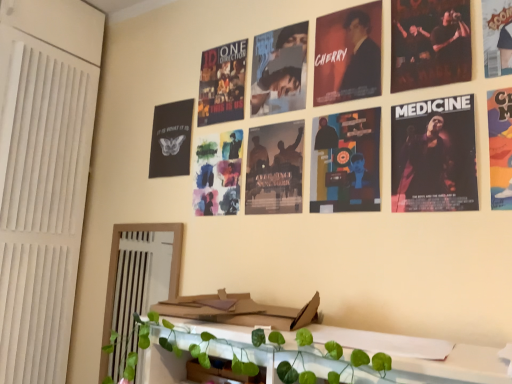
Question: From the image's perspective, is cartoon character poster at upper right, positioned as the sixth poster in left-to-right order, below cardboard magazine at center?

Choices:
 (A) no
 (B) yes

Answer: (A)

Question: Is the depth of cartoon character poster at upper right, which ranks as the first poster in right-to-left order, less than that of cardboard magazine at center?

Choices:
 (A) yes
 (B) no

Answer: (A)

Question: Could you tell me if cartoon character poster at upper right, positioned as the sixth poster in left-to-right order, is facing cardboard magazine at center?

Choices:
 (A) no
 (B) yes

Answer: (A)

Question: Is cartoon character poster at upper right, which ranks as the first poster in right-to-left order, beside cardboard magazine at center?

Choices:
 (A) no
 (B) yes

Answer: (A)

Question: Considering the relative positions of cartoon character poster at upper right, which ranks as the first poster in right-to-left order, and cardboard magazine at center in the image provided, is cartoon character poster at upper right, which ranks as the first poster in right-to-left order, to the right of cardboard magazine at center from the viewer's perspective?

Choices:
 (A) yes
 (B) no

Answer: (A)

Question: In the image, is matte black poster at upper right, arranged as the 3th poster when viewed from the right, positioned in front of or behind cardboard magazine at center?

Choices:
 (A) behind
 (B) front

Answer: (A)

Question: Does point (437, 41) appear closer or farther from the camera than point (237, 317)?

Choices:
 (A) farther
 (B) closer

Answer: (A)

Question: From a real-world perspective, is matte black poster at upper right, arranged as the 3th poster when viewed from the right, physically located above or below cardboard magazine at center?

Choices:
 (A) below
 (B) above

Answer: (B)

Question: In terms of width, does matte black poster at upper right, the fourth poster from the left, look wider or thinner when compared to cardboard magazine at center?

Choices:
 (A) thin
 (B) wide

Answer: (A)

Question: From the image's perspective, relative to colorful paper poster at upper right, arranged as the fifth poster when viewed from the left, is matte black poster at upper right, arranged as the 3th poster when viewed from the right, above or below?

Choices:
 (A) above
 (B) below

Answer: (A)

Question: In the image, is matte black poster at upper right, arranged as the 3th poster when viewed from the right, positioned in front of or behind colorful paper poster at upper right, the 2th poster positioned from the right?

Choices:
 (A) behind
 (B) front

Answer: (A)

Question: In terms of width, does matte black poster at upper right, arranged as the 3th poster when viewed from the right, look wider or thinner when compared to colorful paper poster at upper right, the 2th poster positioned from the right?

Choices:
 (A) thin
 (B) wide

Answer: (B)

Question: From a real-world perspective, is matte black poster at upper right, the fourth poster from the left, above or below colorful paper poster at upper right, arranged as the fifth poster when viewed from the left?

Choices:
 (A) above
 (B) below

Answer: (A)

Question: From a real-world perspective, is cardboard magazine at center positioned above or below dark matte poster at upper center, the fourth poster from the right?

Choices:
 (A) below
 (B) above

Answer: (A)

Question: Visually, is cardboard magazine at center positioned to the left or to the right of dark matte poster at upper center, the fourth poster from the right?

Choices:
 (A) right
 (B) left

Answer: (B)